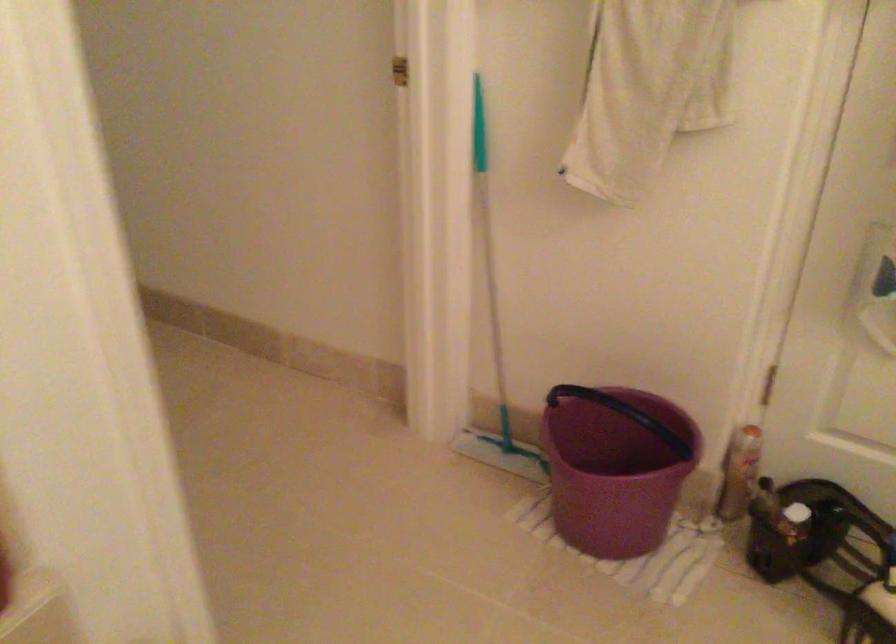
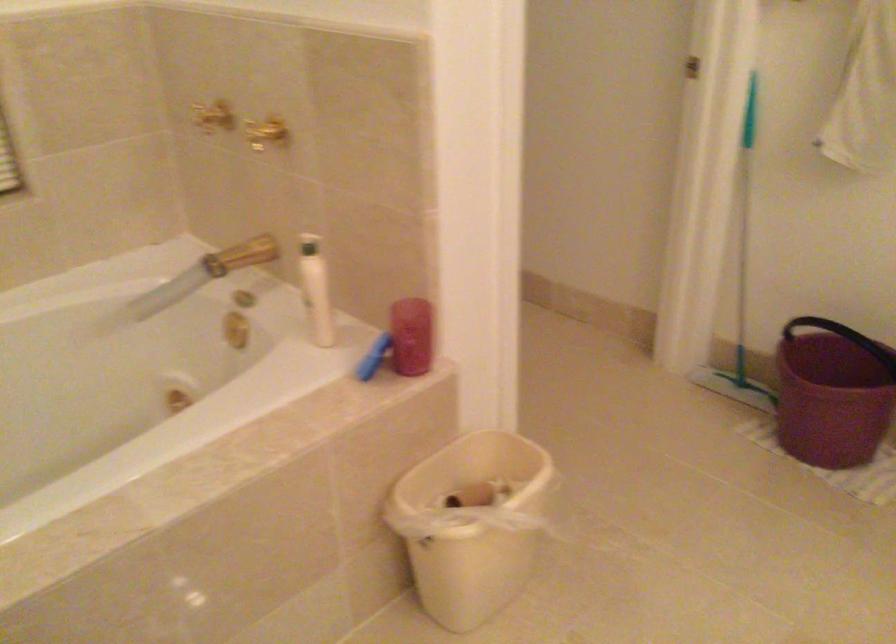
Find the pixel in the second image that matches point 494,333 in the first image.

(742, 279)